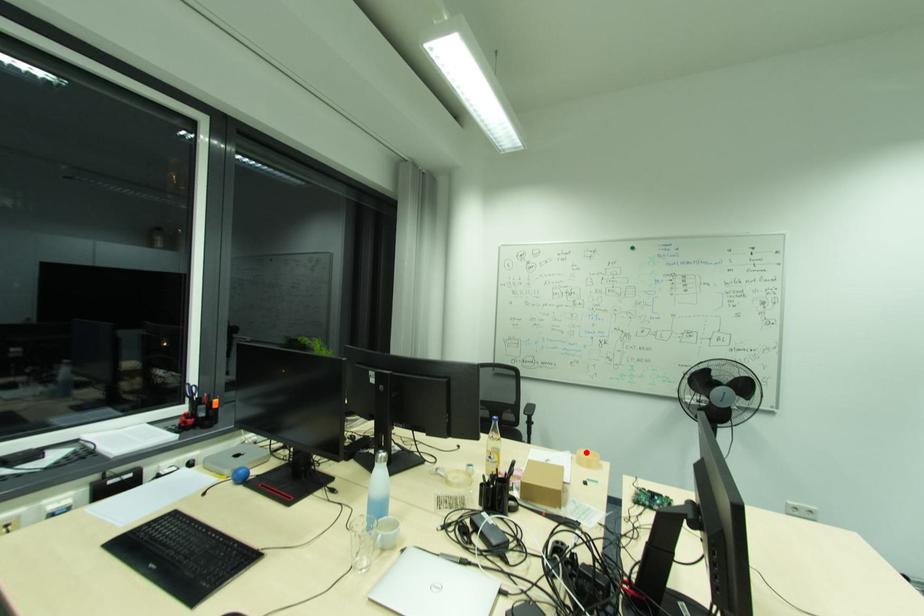
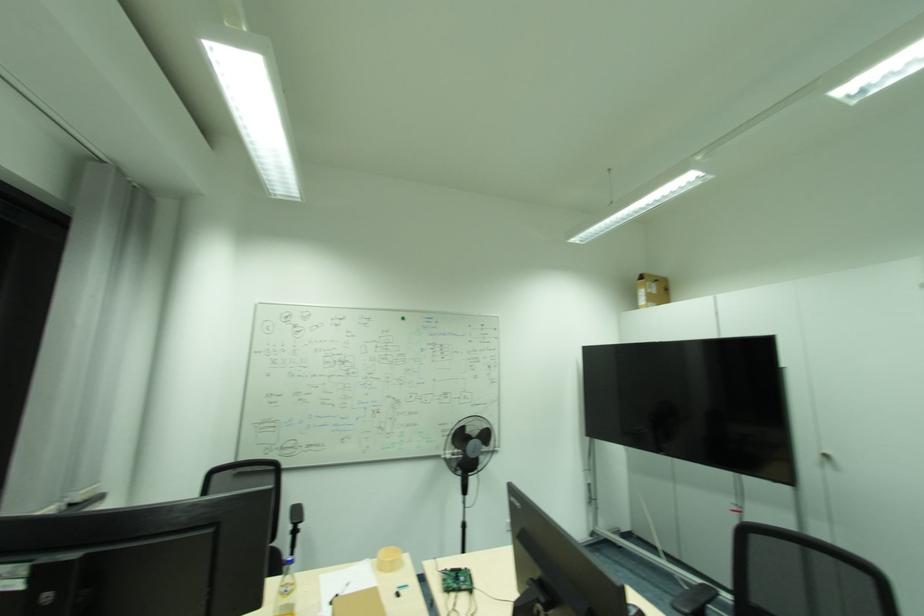
Locate, in the second image, the point that corresponds to the highlighted location in the first image.

(386, 553)